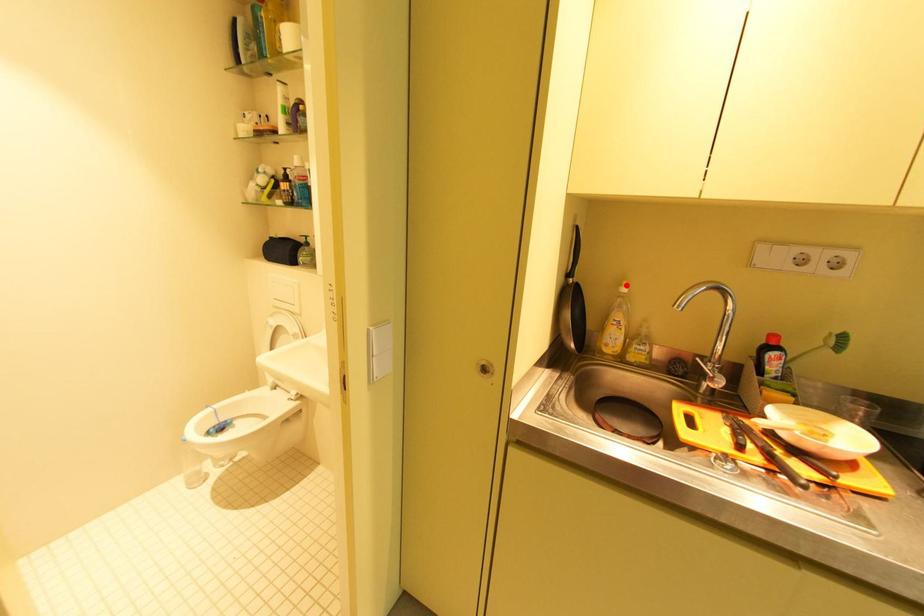
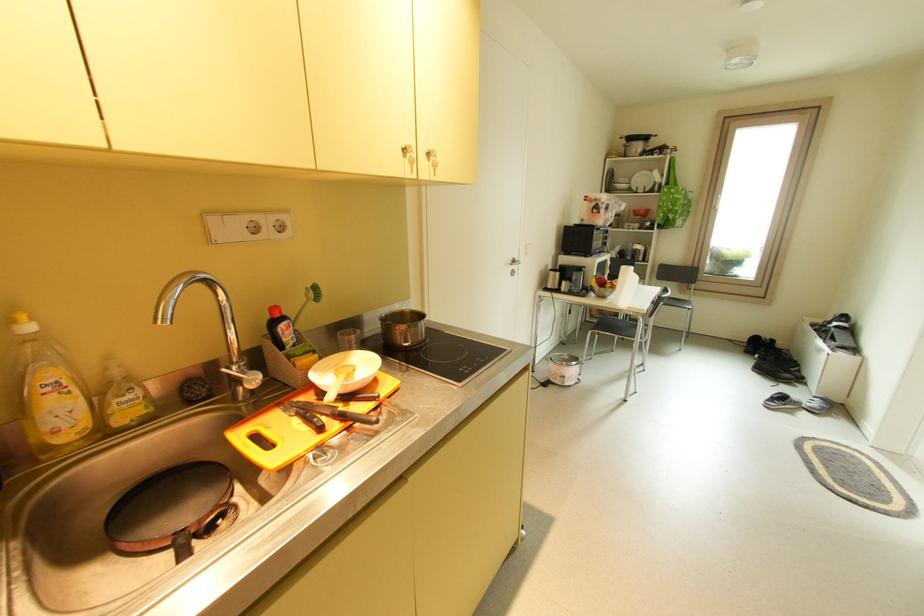
Locate, in the second image, the point that corresponds to the highlighted location in the first image.

(18, 322)